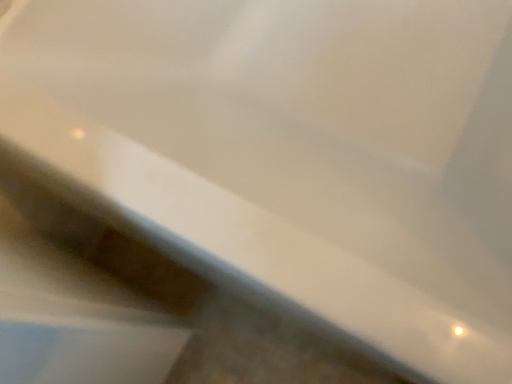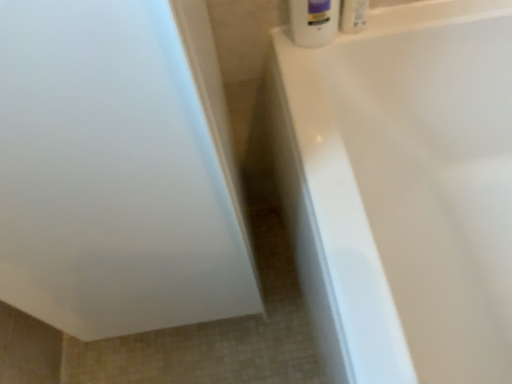
Question: Which way did the camera rotate in the video?

Choices:
 (A) rotated left
 (B) rotated right

Answer: (A)